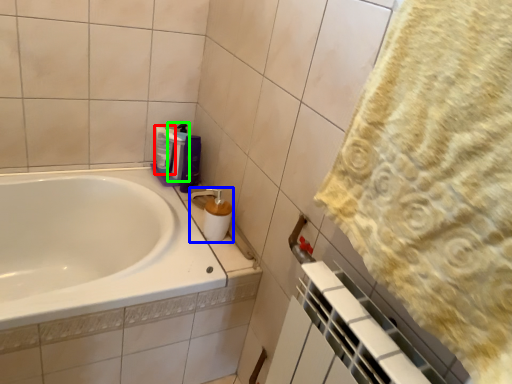
Question: Which is farther away from cleaning product (highlighted by a red box)? soap dispenser (highlighted by a blue box) or cleaning product (highlighted by a green box)?

Choices:
 (A) soap dispenser
 (B) cleaning product

Answer: (A)